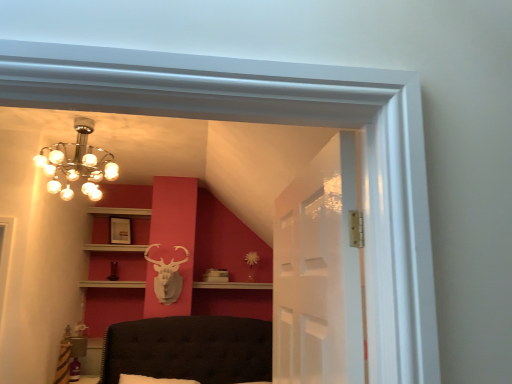
What do you see at coordinates (115, 248) in the screenshot?
I see `white wood shelf at upper center` at bounding box center [115, 248].

Locate an element on the screen. The height and width of the screenshot is (384, 512). matte white picture frame at upper center is located at coordinates (120, 231).

The width and height of the screenshot is (512, 384). What do you see at coordinates (77, 164) in the screenshot?
I see `chrome/metallic chandelier at upper left` at bounding box center [77, 164].

I want to click on transparent glass door at center, so coord(318,273).

From a real-world perspective, is transparent glass door at center beneath chrome/metallic chandelier at upper left?

Correct, in the physical world, transparent glass door at center is lower than chrome/metallic chandelier at upper left.

Considering the sizes of transparent glass door at center and chrome/metallic chandelier at upper left in the image, is transparent glass door at center taller or shorter than chrome/metallic chandelier at upper left?

transparent glass door at center is taller than chrome/metallic chandelier at upper left.

Is transparent glass door at center facing away from chrome/metallic chandelier at upper left?

No, transparent glass door at center is not facing away from chrome/metallic chandelier at upper left.

From a real-world perspective, which object rests below the other?

In real-world perspective, white wood shelf at upper center is lower.

In the scene shown: Is white wood shelf at upper center far from chrome/metallic chandelier at upper left?

white wood shelf at upper center is far away from chrome/metallic chandelier at upper left.

From the picture: In terms of height, does white wood shelf at upper center look taller or shorter compared to chrome/metallic chandelier at upper left?

white wood shelf at upper center is shorter than chrome/metallic chandelier at upper left.

Is point (142, 249) behind point (93, 176)?

Yes.

Between matte white picture frame at upper center and chrome/metallic chandelier at upper left, which one has less height?

Standing shorter between the two is matte white picture frame at upper center.

How many degrees apart are the facing directions of matte white picture frame at upper center and chrome/metallic chandelier at upper left?

32.6 degrees separate the facing orientations of matte white picture frame at upper center and chrome/metallic chandelier at upper left.

From the image's perspective, would you say matte white picture frame at upper center is positioned over chrome/metallic chandelier at upper left?

Incorrect, from the image's perspective, matte white picture frame at upper center is lower than chrome/metallic chandelier at upper left.

Is matte white picture frame at upper center oriented away from chrome/metallic chandelier at upper left?

matte white picture frame at upper center does not have its back to chrome/metallic chandelier at upper left.

Would you say chrome/metallic chandelier at upper left is outside white wood shelf at upper center?

That's correct, chrome/metallic chandelier at upper left is outside of white wood shelf at upper center.

Which point is more forward, (82, 173) or (110, 250)?

Positioned in front is point (82, 173).

Is chrome/metallic chandelier at upper left taller or shorter than white wood shelf at upper center?

chrome/metallic chandelier at upper left is taller than white wood shelf at upper center.

How many degrees apart are the facing directions of white wood shelf at upper center and white matte deer head at center?

There is a 0.564-degree angle between the facing directions of white wood shelf at upper center and white matte deer head at center.

Is white wood shelf at upper center next to white matte deer head at center and touching it?

There is a gap between white wood shelf at upper center and white matte deer head at center.

Is white wood shelf at upper center positioned with its back to white matte deer head at center?

No, white wood shelf at upper center is not facing the opposite direction of white matte deer head at center.

Which object is positioned more to the right, white wood shelf at upper center or white matte deer head at center?

white matte deer head at center is more to the right.

Considering the relative positions of chrome/metallic chandelier at upper left and transparent glass door at center in the image provided, is chrome/metallic chandelier at upper left to the left or to the right of transparent glass door at center?

chrome/metallic chandelier at upper left is to the left of transparent glass door at center.

Is chrome/metallic chandelier at upper left taller than transparent glass door at center?

In fact, chrome/metallic chandelier at upper left may be shorter than transparent glass door at center.

Which is more distant, (130, 225) or (167, 286)?

Positioned behind is point (130, 225).

In the image, is matte white picture frame at upper center on the left side or the right side of white matte deer head at center?

From the image, it's evident that matte white picture frame at upper center is to the left of white matte deer head at center.

Looking at this image, is matte white picture frame at upper center positioned with its back to white matte deer head at center?

No, matte white picture frame at upper center's orientation is not away from white matte deer head at center.

Are matte white picture frame at upper center and white matte deer head at center far apart?

No, there isn't a large distance between matte white picture frame at upper center and white matte deer head at center.

You are a GUI agent. You are given a task and a screenshot of the screen. Output one action in this format:
    pyautogui.click(x=<x>, y=<y>)
    Task: Click on the glass door in front of the chrome/metallic chandelier at upper left
    The height and width of the screenshot is (384, 512).
    Given the screenshot: What is the action you would take?
    coord(318,273)

Where is `shelf that is under the chrome/metallic chandelier at upper left (from a real-world perspective)`? This screenshot has width=512, height=384. shelf that is under the chrome/metallic chandelier at upper left (from a real-world perspective) is located at coordinates (115, 248).

Estimate the real-world distances between objects in this image. Which object is further from chrome/metallic chandelier at upper left, white matte deer head at center or transparent glass door at center?

transparent glass door at center.

Considering their positions, is white wood shelf at upper center positioned further to matte white picture frame at upper center than transparent glass door at center?

transparent glass door at center lies further to matte white picture frame at upper center than the other object.

In the scene shown: Which object lies nearer to the anchor point transparent glass door at center, white wood shelf at upper center or white matte deer head at center?

white matte deer head at center is positioned closer to the anchor transparent glass door at center.

Considering their positions, is matte white picture frame at upper center positioned closer to white matte deer head at center than chrome/metallic chandelier at upper left?

matte white picture frame at upper center is positioned closer to the anchor white matte deer head at center.

Looking at this image, estimate the real-world distances between objects in this image. Which object is closer to white wood shelf at upper center, transparent glass door at center or white matte deer head at center?

The object closer to white wood shelf at upper center is white matte deer head at center.

Which object lies nearer to the anchor point white wood shelf at upper center, transparent glass door at center or chrome/metallic chandelier at upper left?

chrome/metallic chandelier at upper left is closer to white wood shelf at upper center.

Estimate the real-world distances between objects in this image. Which object is further from matte white picture frame at upper center, transparent glass door at center or white wood shelf at upper center?

transparent glass door at center is positioned further to the anchor matte white picture frame at upper center.

Looking at the image, which one is located closer to white matte deer head at center, white wood shelf at upper center or transparent glass door at center?

white wood shelf at upper center.

You are a GUI agent. You are given a task and a screenshot of the screen. Output one action in this format:
    pyautogui.click(x=<x>, y=<y>)
    Task: Click on the shelf between chrome/metallic chandelier at upper left and matte white picture frame at upper center from front to back
    
    Given the screenshot: What is the action you would take?
    pyautogui.click(x=115, y=248)

Identify the location of deer positioned between transparent glass door at center and white wood shelf at upper center from near to far. (167, 276).

In order to click on lamp between transparent glass door at center and white wood shelf at upper center along the z-axis in this screenshot , I will do `click(77, 164)`.

Locate an element on the screen. The height and width of the screenshot is (384, 512). picture frame between white wood shelf at upper center and white matte deer head at center from left to right is located at coordinates (120, 231).